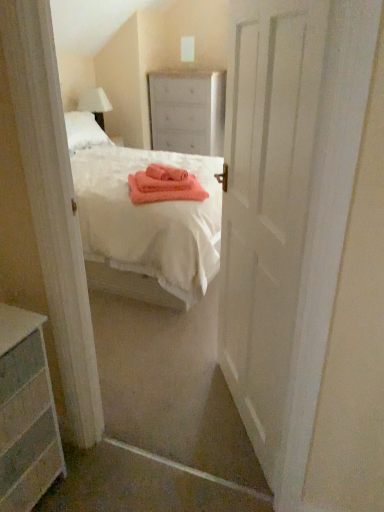
Question: From a real-world perspective, relative to white fabric lampshade at upper left, is gray striped dresser at lower left vertically above or below?

Choices:
 (A) below
 (B) above

Answer: (A)

Question: Is gray striped dresser at lower left wider or thinner than white fabric lampshade at upper left?

Choices:
 (A) wide
 (B) thin

Answer: (A)

Question: Which object is positioned farthest from the white fabric lampshade at upper left?

Choices:
 (A) white matte door at center
 (B) white wood dresser at upper center
 (C) gray striped dresser at lower left

Answer: (C)

Question: Which of these objects is positioned closest to the gray striped dresser at lower left?

Choices:
 (A) white wood dresser at upper center
 (B) white matte door at center
 (C) white fabric lampshade at upper left

Answer: (B)